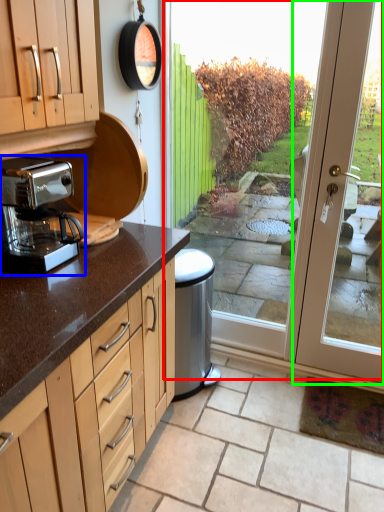
Question: Estimate the real-world distances between objects in this image. Which object is farther from screen door (highlighted by a red box), coffee maker (highlighted by a blue box) or door (highlighted by a green box)?

Choices:
 (A) coffee maker
 (B) door

Answer: (A)